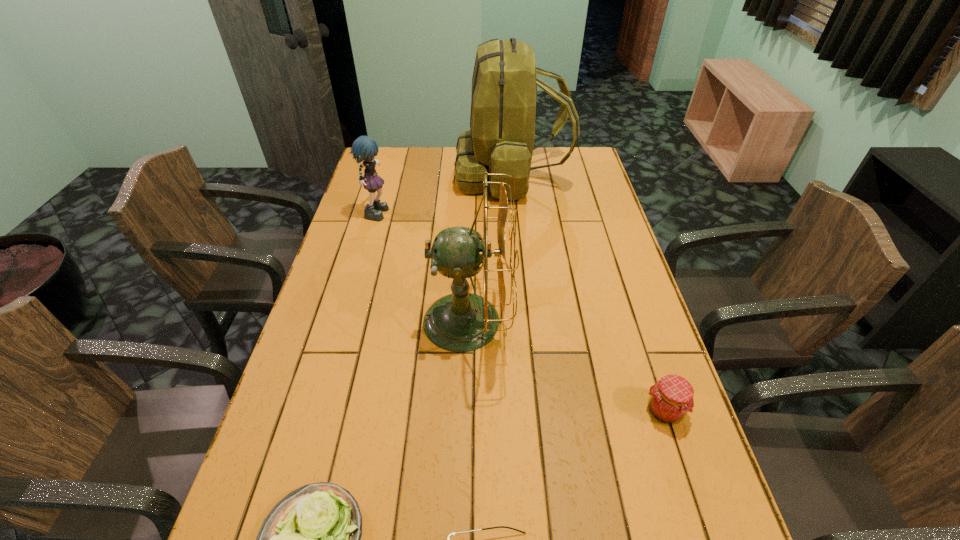
This screenshot has width=960, height=540. Find the location of `backpack`. backpack is located at coordinates (501, 138).

Image resolution: width=960 pixels, height=540 pixels. Identify the location of the second tallest object. (459, 322).

Identify the location of fan. The image size is (960, 540). (459, 322).

Image resolution: width=960 pixels, height=540 pixels. Identify the location of the third tallest object. (364, 148).

Locate an element on the screen. the rightmost object is located at coordinates (671, 398).

The width and height of the screenshot is (960, 540). Find the location of `the fourth tallest object`. the fourth tallest object is located at coordinates (671, 398).

Find the location of `blank space located on the front-facing side of the backpack`. blank space located on the front-facing side of the backpack is located at coordinates (412, 174).

The image size is (960, 540). Find the location of `free location located 0.240m on the front-facing side of the backpack`. free location located 0.240m on the front-facing side of the backpack is located at coordinates (395, 174).

I want to click on vacant area situated on the front-facing side of the backpack, so pyautogui.click(x=435, y=174).

The width and height of the screenshot is (960, 540). What are the coordinates of `vacant area situated in front of the fan, directing air flow` in the screenshot? It's located at (579, 321).